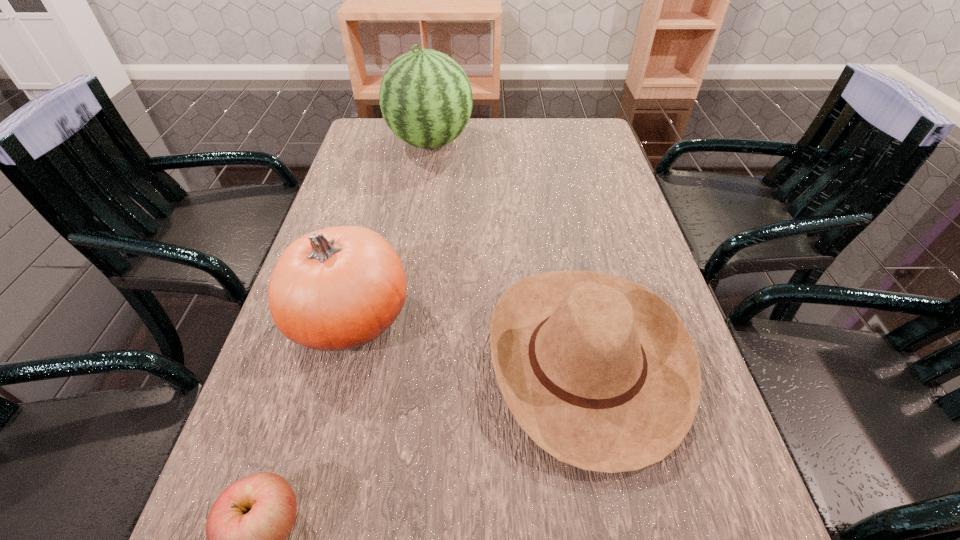
Where is `object that is at the far edge`? The width and height of the screenshot is (960, 540). object that is at the far edge is located at coordinates (426, 99).

Where is `watermelon that is at the left edge`? This screenshot has height=540, width=960. watermelon that is at the left edge is located at coordinates (426, 99).

Where is `pumpkin located in the left edge section of the desktop`? This screenshot has width=960, height=540. pumpkin located in the left edge section of the desktop is located at coordinates (338, 288).

Find the location of a particular element. object that is positioned at the right edge is located at coordinates (600, 372).

I want to click on object that is positioned at the far left corner, so click(x=426, y=99).

Where is `vacant space at the far edge of the desktop`? vacant space at the far edge of the desktop is located at coordinates (473, 157).

What are the coordinates of `free space at the left edge of the desktop` in the screenshot? It's located at (378, 168).

This screenshot has height=540, width=960. In order to click on vacant space at the right edge in this screenshot , I will do `click(614, 162)`.

Identify the location of free region at the far left corner. (360, 138).

Where is `free area in between the third tallest object and the pumpkin`? free area in between the third tallest object and the pumpkin is located at coordinates (468, 339).